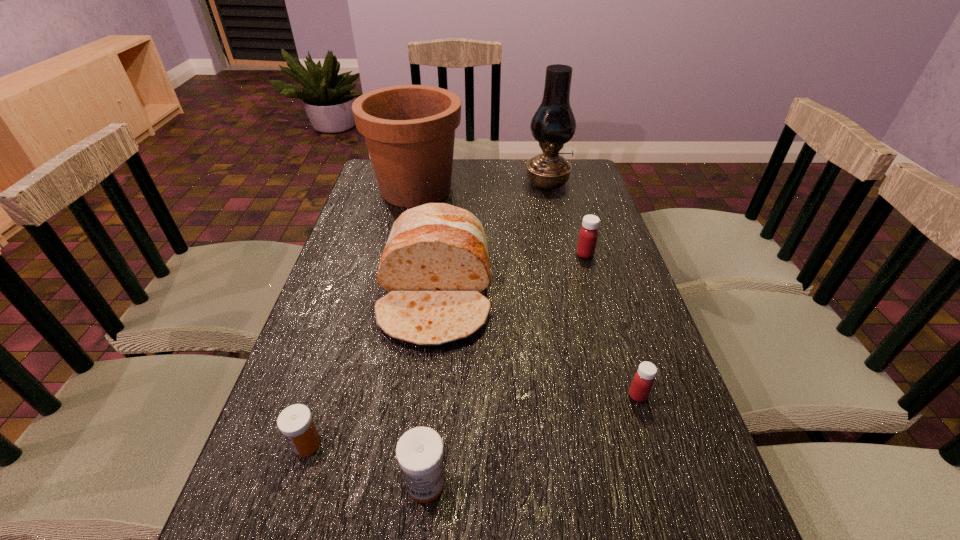
You are a GUI agent. You are given a task and a screenshot of the screen. Output one action in this format:
    pyautogui.click(x=<x>, y=<y>)
    Task: Click on the flowerpot that is positioned at the far edge
    
    Given the screenshot: What is the action you would take?
    pyautogui.click(x=409, y=130)

You are a GUI agent. You are given a task and a screenshot of the screen. Output one action in this format:
    pyautogui.click(x=<x>, y=<y>)
    Task: Click on the flowerpot that is at the left edge
    
    Given the screenshot: What is the action you would take?
    pyautogui.click(x=409, y=130)

This screenshot has height=540, width=960. I want to click on bread at the left edge, so click(x=435, y=265).

Find the location of a particular element. The image size is (960, 540). medicine located at the left edge is located at coordinates (295, 422).

At what (x,y) coordinates should I click in order to perform the action: click on oil lamp that is positioned at the right edge. Please return your answer as a coordinate pair (x, y). This screenshot has width=960, height=540. Looking at the image, I should click on (553, 124).

In order to click on object that is at the far left corner in this screenshot , I will do `click(409, 130)`.

This screenshot has width=960, height=540. What are the coordinates of `object positioned at the far right corner` in the screenshot? It's located at coord(553,124).

Image resolution: width=960 pixels, height=540 pixels. In the image, there is a desktop. Find the location of `free space at the left edge`. free space at the left edge is located at coordinates tap(233, 534).

In the image, there is a desktop. What are the coordinates of `free region at the right edge` in the screenshot? It's located at (581, 225).

At what (x,y) coordinates should I click in order to perform the action: click on free space between the bread and the third nearest medicine. Please return your answer as a coordinate pair (x, y). The height and width of the screenshot is (540, 960). Looking at the image, I should click on (537, 345).